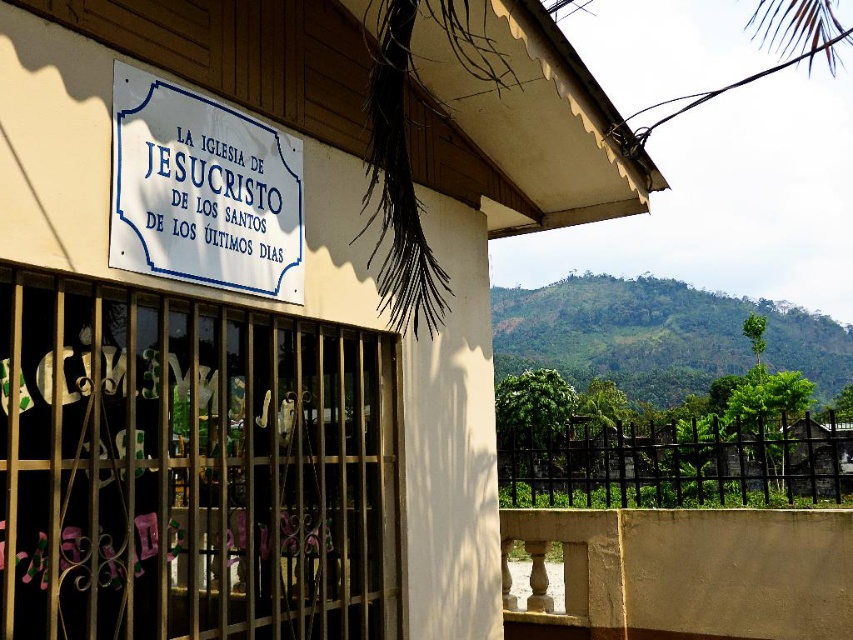
Question: Among these objects, which one is nearest to the camera?

Choices:
 (A) white paper sign at upper center
 (B) white matte sign at upper center
 (C) black metal fence at lower right

Answer: (B)

Question: Observing the image, what is the correct spatial positioning of white matte sign at upper center in reference to white paper sign at upper center?

Choices:
 (A) left
 (B) right

Answer: (A)

Question: Is white matte sign at upper center smaller than black metal fence at lower right?

Choices:
 (A) no
 (B) yes

Answer: (B)

Question: Considering the real-world distances, which object is farthest from the white paper sign at upper center?

Choices:
 (A) white matte sign at upper center
 (B) black metal fence at lower right

Answer: (B)

Question: From the image, what is the correct spatial relationship of white matte sign at upper center in relation to black metal fence at lower right?

Choices:
 (A) below
 (B) above

Answer: (B)

Question: Which point is farther from the camera taking this photo?

Choices:
 (A) (4, 563)
 (B) (759, 461)

Answer: (B)